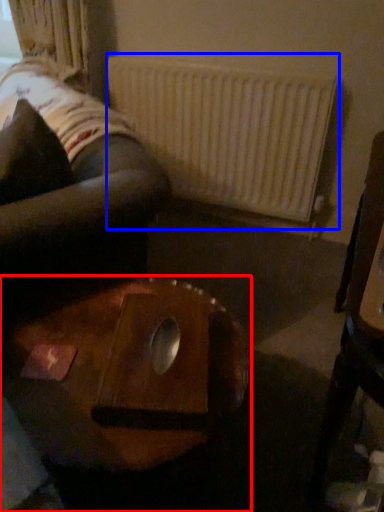
Question: Which point is closer to the camera, table (highlighted by a red box) or radiator (highlighted by a blue box)?

Choices:
 (A) table
 (B) radiator

Answer: (A)